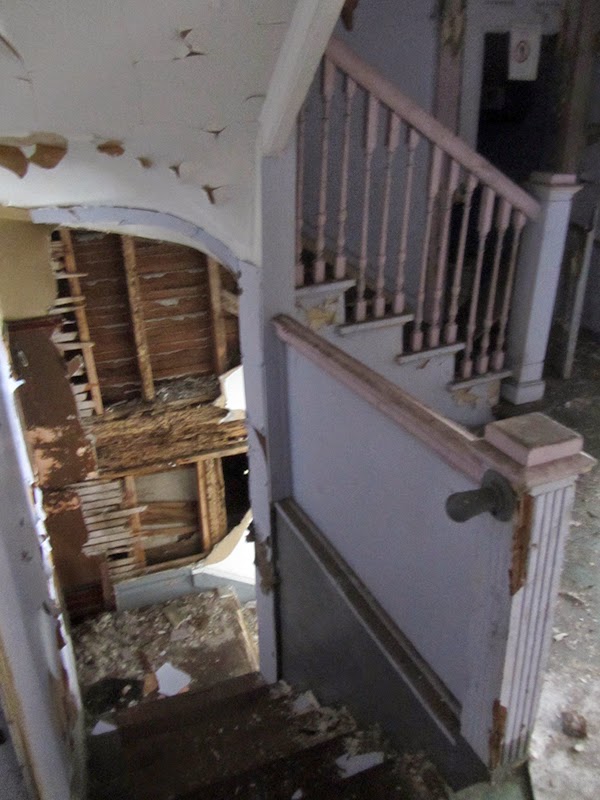
You are a GUI agent. You are given a task and a screenshot of the screen. Output one action in this format:
    pyautogui.click(x=<x>, y=<y>)
    Task: Click on the banister
    This screenshot has width=600, height=800.
    Given the screenshot: What is the action you would take?
    pyautogui.click(x=421, y=113)